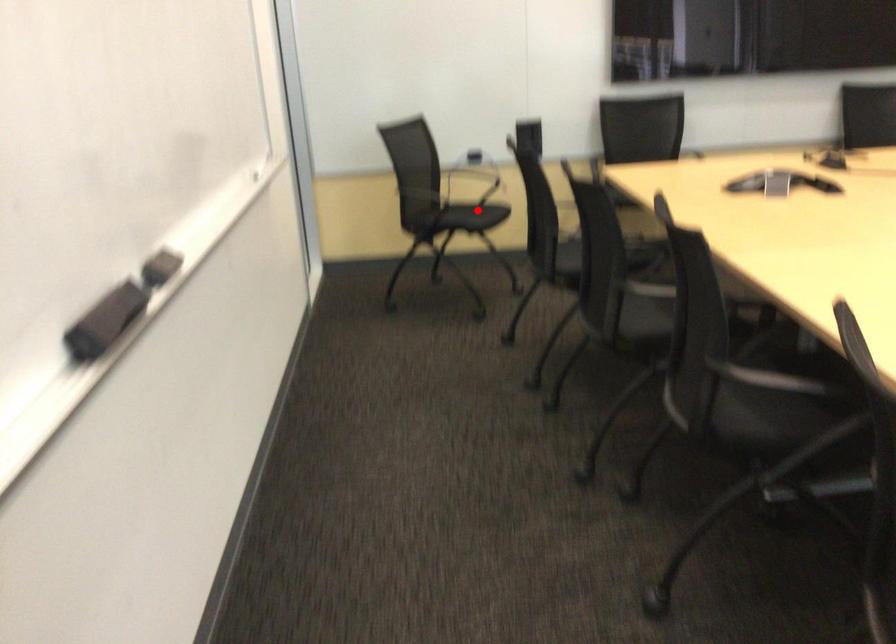
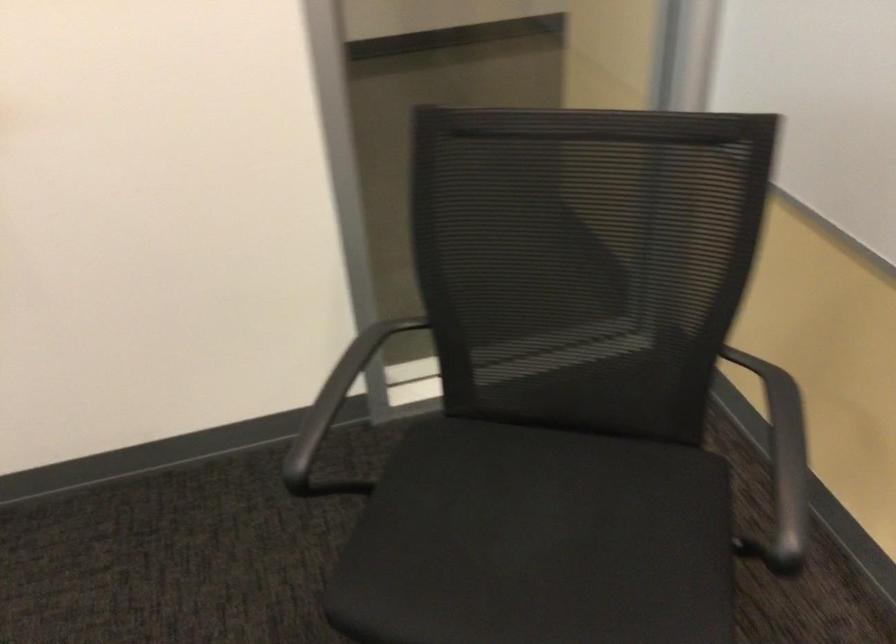
The point at the highlighted location is marked in the first image. Where is the corresponding point in the second image?

(538, 542)